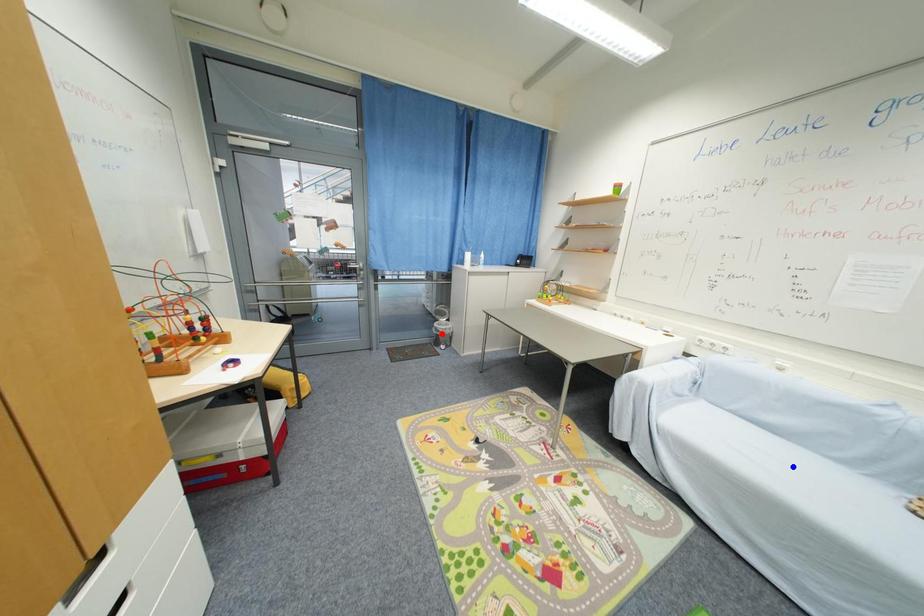
Question: In the image, two points are highlighted. Which point is nearer to the camera? Reply with the corresponding letter.

Choices:
 (A) blue point
 (B) red point

Answer: (A)